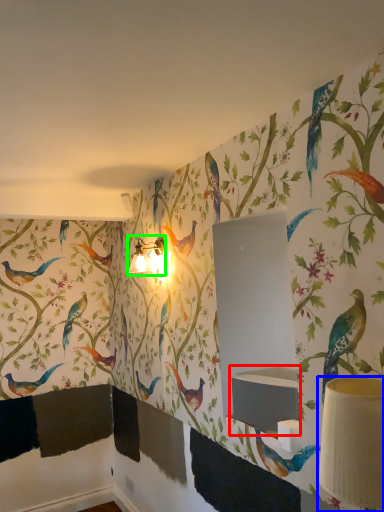
Question: Considering the real-world distances, which object is farthest from sink (highlighted by a red box)? table lamp (highlighted by a blue box) or table lamp (highlighted by a green box)?

Choices:
 (A) table lamp
 (B) table lamp

Answer: (B)